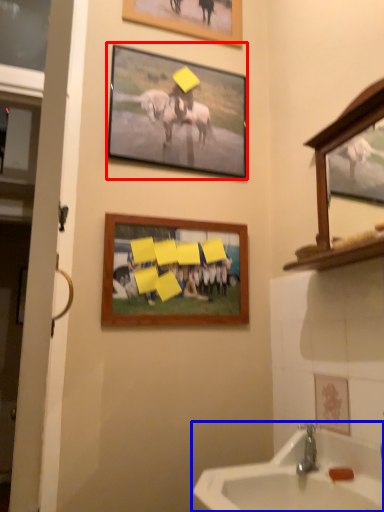
Question: Which point is closer to the camera, picture frame (highlighted by a red box) or sink (highlighted by a blue box)?

Choices:
 (A) picture frame
 (B) sink

Answer: (B)